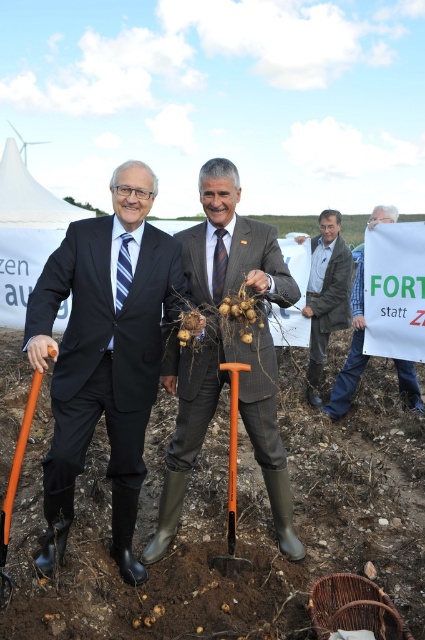
You are a photographer at this event and need to capture a photo that includes both the matte gray suit at center and the orange plastic shovel at lower left. Based on their positions, which object should be placed higher in the frame to ensure both are visible?

The matte gray suit at center is located above the orange plastic shovel at lower left, so to include both in the frame, the matte gray suit at center should be placed higher in the photo.

You are organizing a community garden event and need to distribute tools. You have a denim jacket at center and an orange plastic shovel at lower left. Which item can you place in a storage box that can only hold items smaller than the shovel?

The orange plastic shovel at lower left cannot be placed in the storage box because the denim jacket at center is larger than the orange plastic shovel at lower left, so the shovel is smaller and would fit, but the question asks for items smaller than the shovel. Wait, there might be confusion here. Let me recheck the description. The denim jacket is larger than the shovel. The storage box can only hold items smaller than the shovel. Therefore, neither the jacket nor the shovel can fit because the jacket is

You are organizing a community garden event and need to place a sign between the denim jacket at center and the orange plastic shovel at lower left. Since the sign needs to be taller than both objects, which object should the sign be placed closer to to ensure visibility?

The denim jacket at center is taller than the orange plastic shovel at lower left, so placing the sign closer to the denim jacket at center would ensure it is taller than both objects for better visibility.